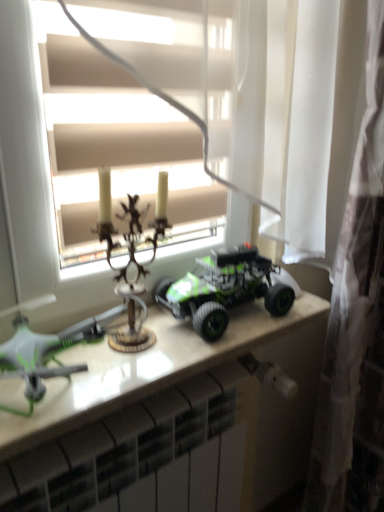
The width and height of the screenshot is (384, 512). I want to click on free location above white glossy table at center (from a real-world perspective), so click(155, 343).